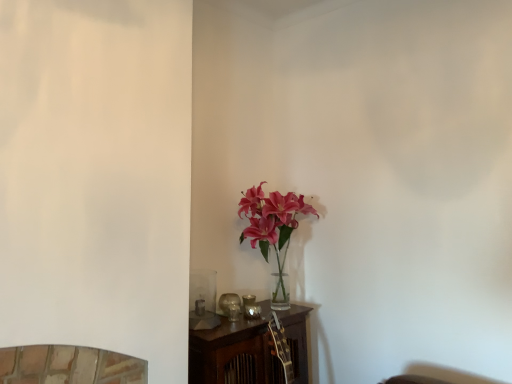
Describe the element at coordinates (272, 228) in the screenshot. I see `translucent glass vase at center` at that location.

Where is `translucent glass vase at center`? The image size is (512, 384). translucent glass vase at center is located at coordinates (272, 228).

This screenshot has height=384, width=512. What are the coordinates of `translucent glass vase at center` in the screenshot? It's located at (272, 228).